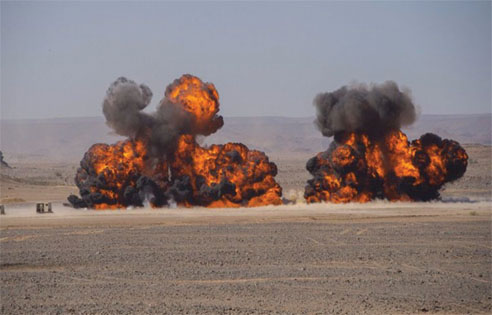
Where is `box`? This screenshot has width=492, height=315. box is located at coordinates (50, 207), (42, 207).